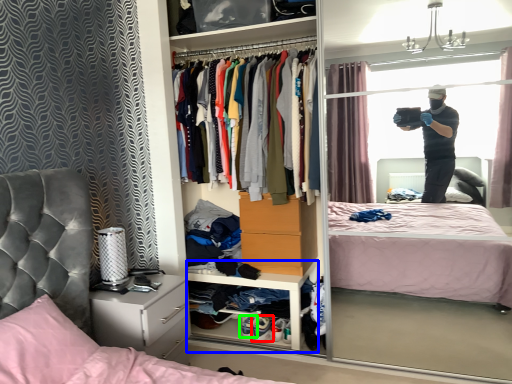
Question: Estimate the real-world distances between objects in this image. Which object is closer to footwear (highlighted by a red box), cabinet (highlighted by a blue box) or footwear (highlighted by a green box)?

Choices:
 (A) cabinet
 (B) footwear

Answer: (B)